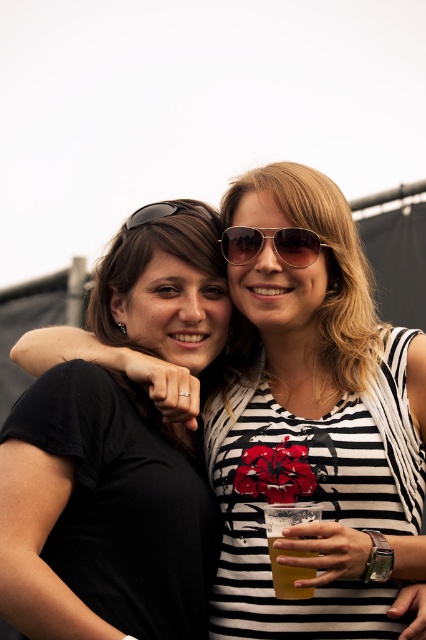
Question: Is black matte shirt at center below matte black sunglasses at upper left?

Choices:
 (A) yes
 (B) no

Answer: (A)

Question: Considering the real-world distances, which object is farthest from the black matte shirt at center?

Choices:
 (A) matte black sunglasses at upper left
 (B) gold metallic aviator sunglasses at center
 (C) black matte shirt at left
 (D) translucent plastic cup at lower center

Answer: (A)

Question: Which point appears closest to the camera in this image?

Choices:
 (A) (385, 490)
 (B) (86, 465)
 (C) (241, 257)
 (D) (298, 518)

Answer: (D)

Question: Which of the following is the closest to the observer?

Choices:
 (A) gold metallic aviator sunglasses at center
 (B) matte black sunglasses at upper left

Answer: (A)

Question: Does gold metallic aviator sunglasses at center have a smaller size compared to matte black sunglasses at upper left?

Choices:
 (A) yes
 (B) no

Answer: (A)

Question: Does gold metallic aviator sunglasses at center come in front of matte black sunglasses at upper left?

Choices:
 (A) yes
 (B) no

Answer: (A)